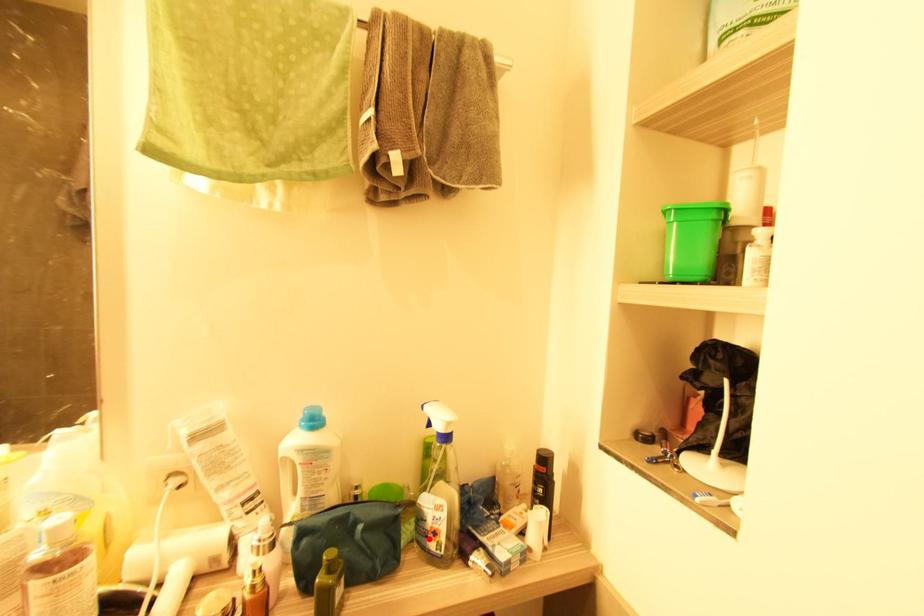
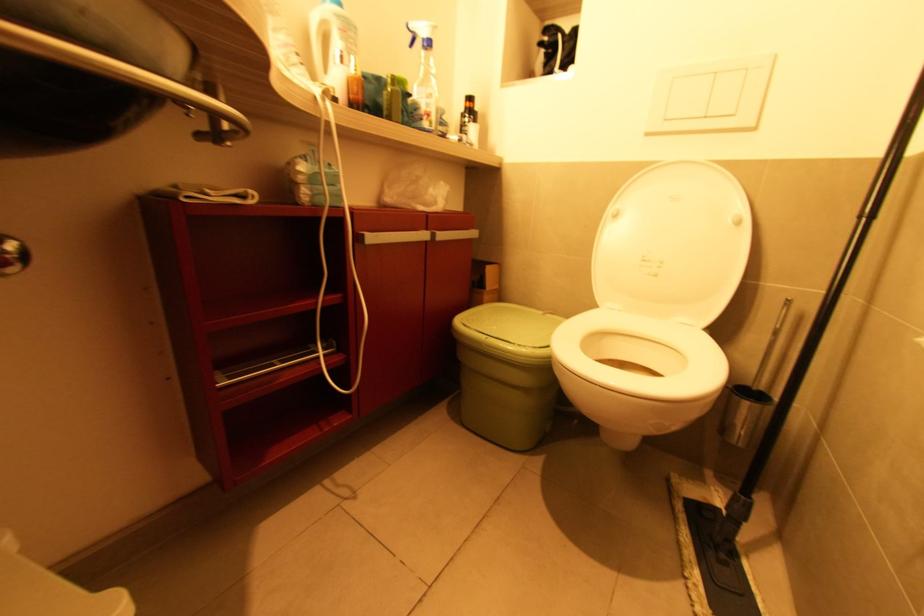
The point at the highlighted location is marked in the first image. Where is the corresponding point in the second image?

(424, 121)